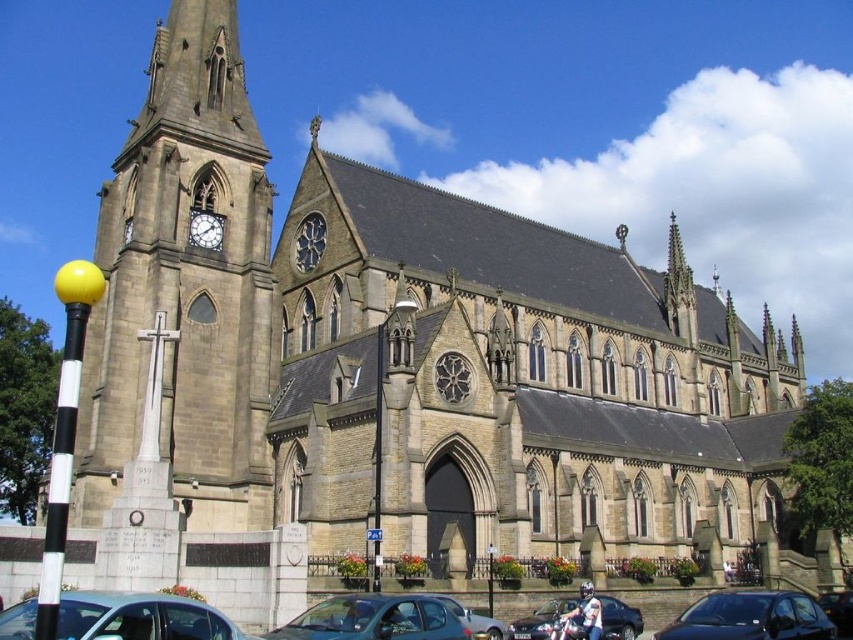
Can you confirm if metallic silver car at lower center is positioned below white clock face at upper left?

Yes, metallic silver car at lower center is below white clock face at upper left.

Based on the photo, can you confirm if metallic silver car at lower center is shorter than white clock face at upper left?

Incorrect, metallic silver car at lower center's height does not fall short of white clock face at upper left's.

Which is behind, point (514, 630) or point (194, 232)?

The point (194, 232) is behind.

Identify the location of metallic silver car at lower center. (540, 620).

Is stone clock tower at left taller than shiny black car at center?

Indeed, stone clock tower at left has a greater height compared to shiny black car at center.

Is stone clock tower at left above shiny black car at center?

Indeed, stone clock tower at left is positioned over shiny black car at center.

Does point (252, 192) come closer to viewer compared to point (851, 618)?

That is False.

Where is `stone clock tower at left`? The height and width of the screenshot is (640, 853). stone clock tower at left is located at coordinates (184, 285).

Between metallic blue hatchback at lower center and shiny black car at center, which one is positioned higher?

Positioned higher is metallic blue hatchback at lower center.

Does metallic blue hatchback at lower center lie in front of shiny black car at center?

Yes, it is in front of shiny black car at center.

Identify the location of metallic blue hatchback at lower center. The image size is (853, 640). (375, 618).